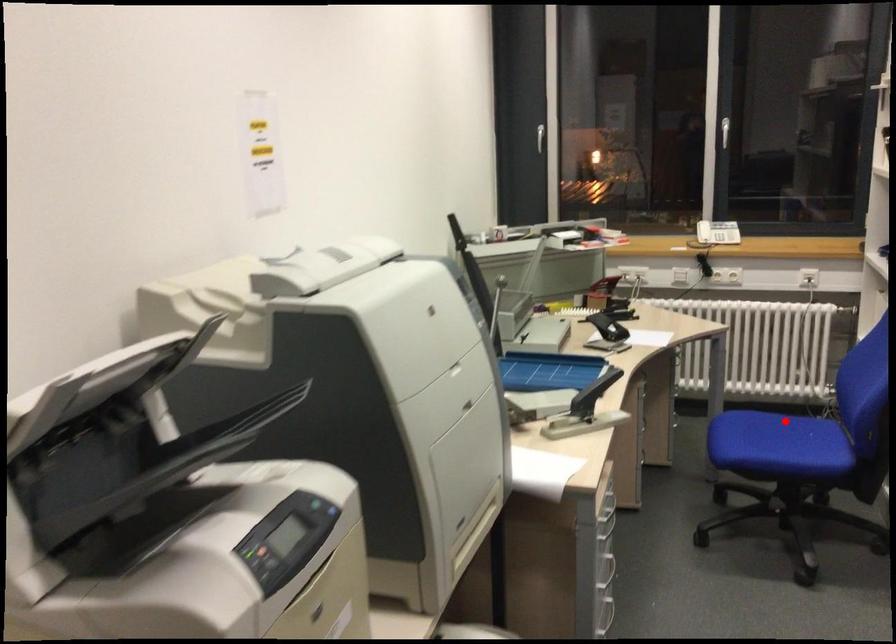
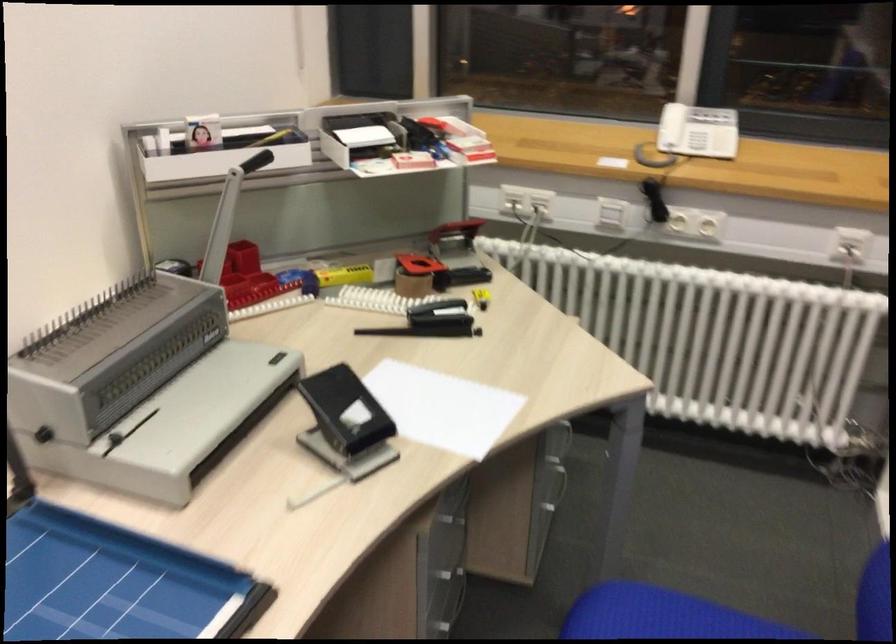
Locate, in the second image, the point that corresponds to the highlighted location in the first image.

(713, 611)